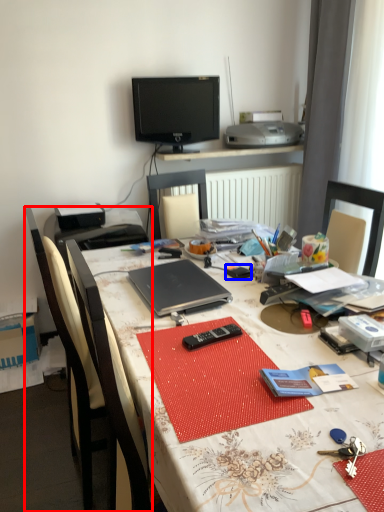
Question: Which of the following is the closest to the observer, chair (highlighted by a red box) or stationery (highlighted by a blue box)?

Choices:
 (A) chair
 (B) stationery

Answer: (A)